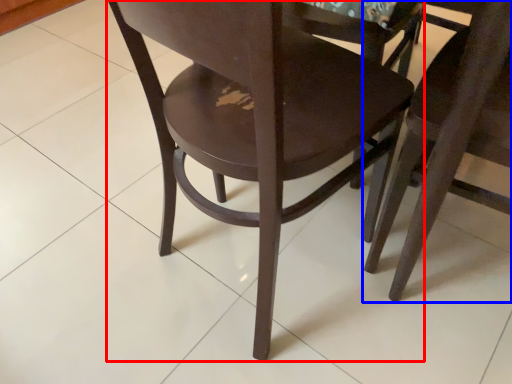
Question: Which object is further to the camera taking this photo, chair (highlighted by a red box) or chair (highlighted by a blue box)?

Choices:
 (A) chair
 (B) chair

Answer: (B)